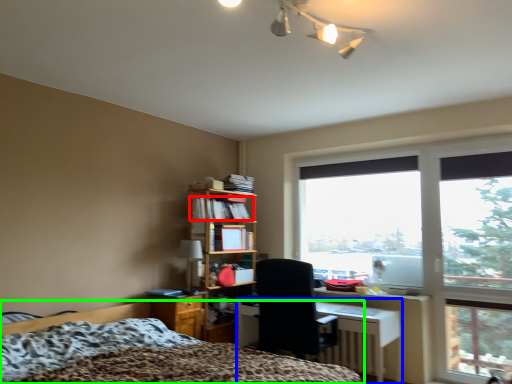
Question: Which object is the farthest from book (highlighted by a red box)? Choose among these: desk (highlighted by a blue box) or bed (highlighted by a green box).

Choices:
 (A) desk
 (B) bed

Answer: (A)